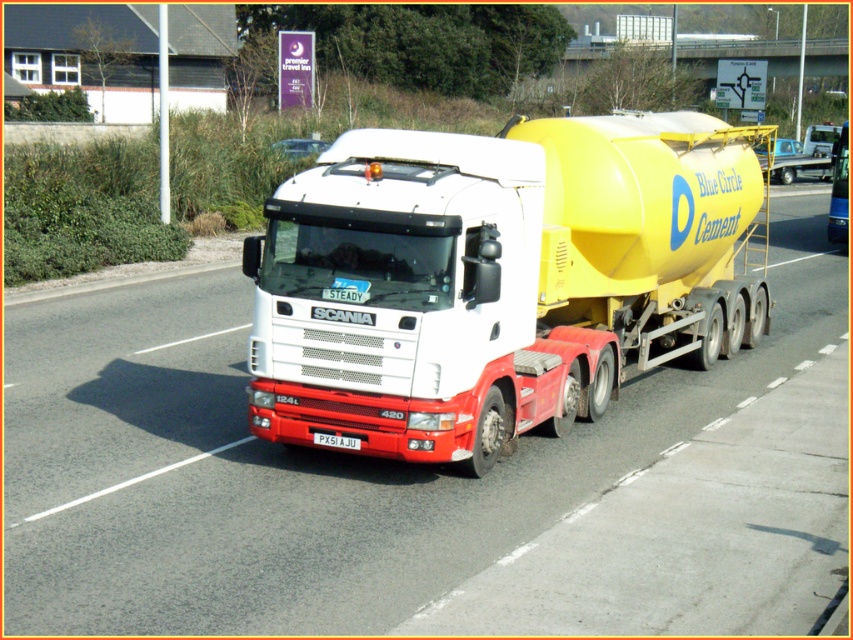
Which is more to the left, white glossy concrete mixer truck at center or white plastic license plate at center?

Result: white plastic license plate at center is more to the left.

Who is taller, white glossy concrete mixer truck at center or white plastic license plate at center?

white glossy concrete mixer truck at center

Identify the location of white glossy concrete mixer truck at center. (292, 465).

Between yellow matte cement tank at center and white glossy concrete mixer truck at center, which one has less height?

Standing shorter between the two is white glossy concrete mixer truck at center.

Locate an element on the screen. Image resolution: width=853 pixels, height=640 pixels. yellow matte cement tank at center is located at coordinates (497, 276).

Find the location of a particular element. yellow matte cement tank at center is located at coordinates (497, 276).

Does point (461, 346) lie in front of point (352, 444)?

Yes, it is.

Looking at this image, is yellow matte cement tank at center taller than white plastic license plate at center?

Yes, yellow matte cement tank at center is taller than white plastic license plate at center.

At what (x,y) coordinates should I click in order to perform the action: click on yellow matte cement tank at center. Please return your answer as a coordinate pair (x, y). This screenshot has width=853, height=640. Looking at the image, I should click on (497, 276).